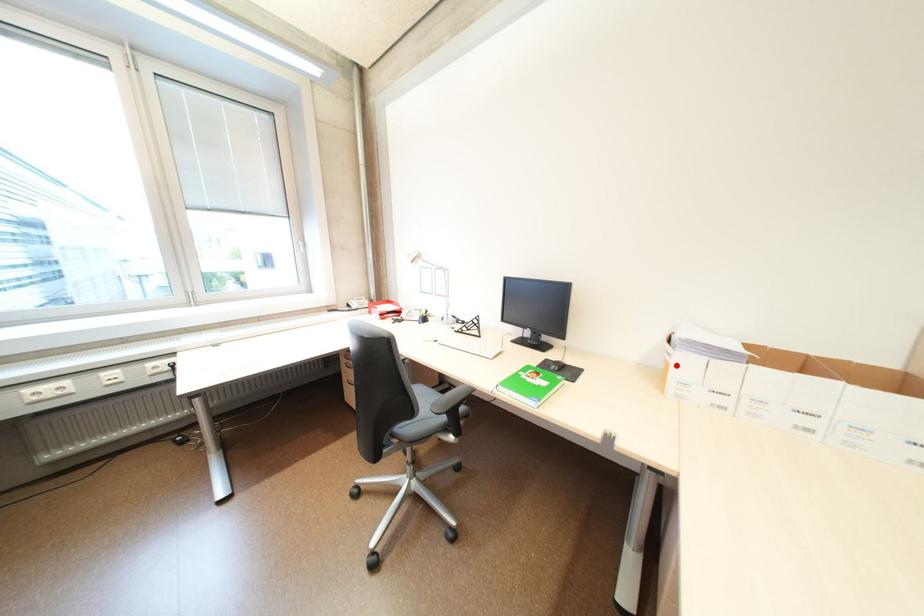
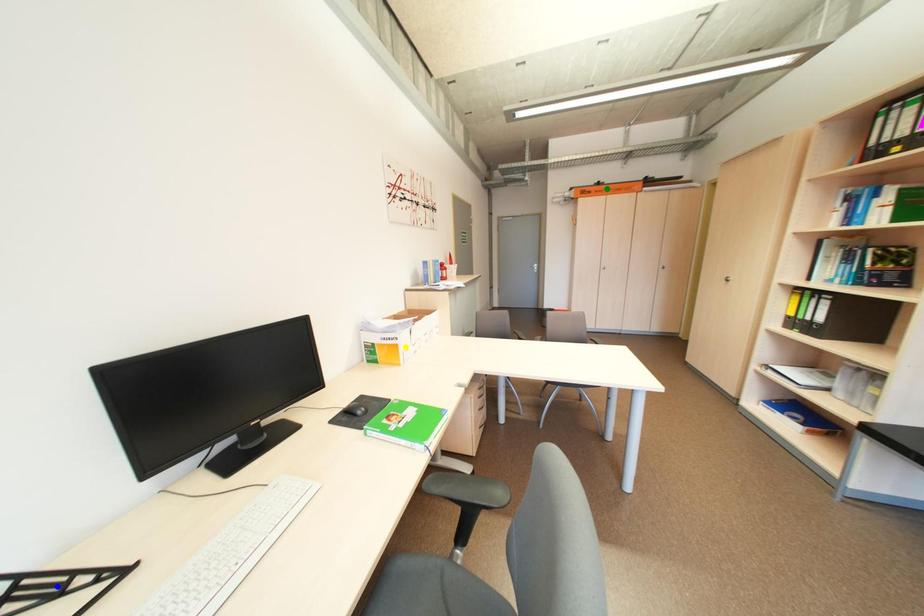
Question: I am providing you with two images of the same scene from different viewpoints. A red point is marked on the first image. You are given multiple points on the second image. Can you choose the point in image 2 that corresponds to the point in image 1?

Choices:
 (A) blue point
 (B) green point
 (C) yellow point

Answer: (C)